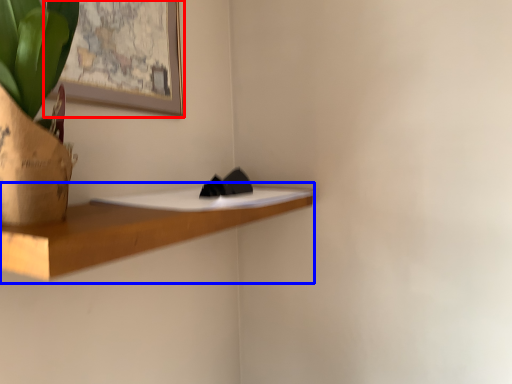
Question: Which object is further to the camera taking this photo, picture frame (highlighted by a red box) or shelf (highlighted by a blue box)?

Choices:
 (A) picture frame
 (B) shelf

Answer: (A)